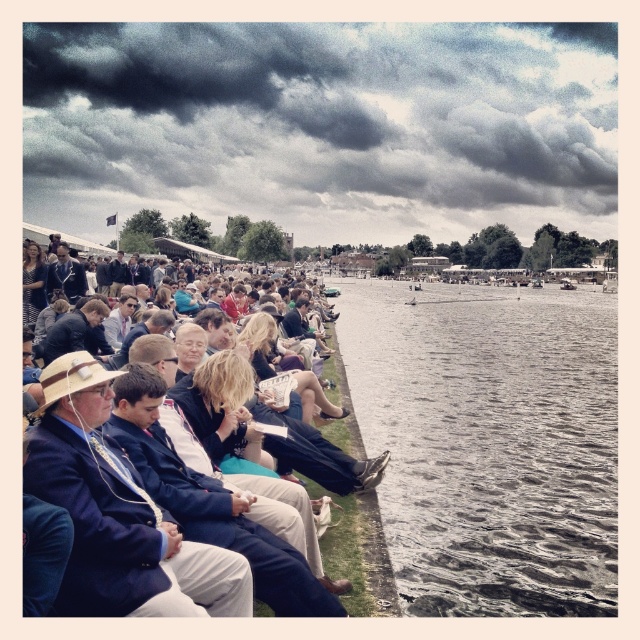
Question: Does dark cloudy sky at upper center have a lesser width compared to gray water at center?

Choices:
 (A) no
 (B) yes

Answer: (A)

Question: Which object is farther from the camera taking this photo?

Choices:
 (A) dark cloudy sky at upper center
 (B) dark blue suit at center
 (C) gray water at center

Answer: (A)

Question: Is dark cloudy sky at upper center further to camera compared to dark blue suit at center?

Choices:
 (A) yes
 (B) no

Answer: (A)

Question: Which point is closer to the camera taking this photo?

Choices:
 (A) (138, 100)
 (B) (467, 396)

Answer: (B)

Question: Which point is farther to the camera?

Choices:
 (A) gray water at center
 (B) dark cloudy sky at upper center

Answer: (B)

Question: Can you confirm if dark cloudy sky at upper center is smaller than dark blue suit at center?

Choices:
 (A) yes
 (B) no

Answer: (B)